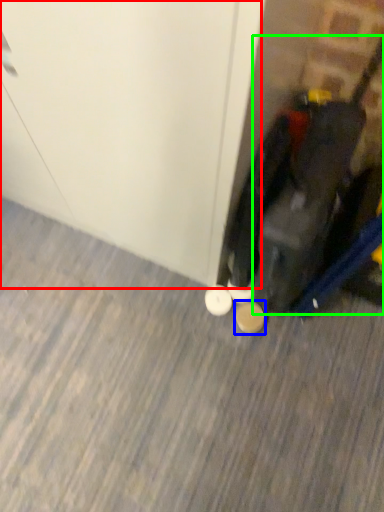
Question: Which is farther away from door (highlighted by a red box)? footwear (highlighted by a blue box) or luggage (highlighted by a green box)?

Choices:
 (A) footwear
 (B) luggage

Answer: (A)